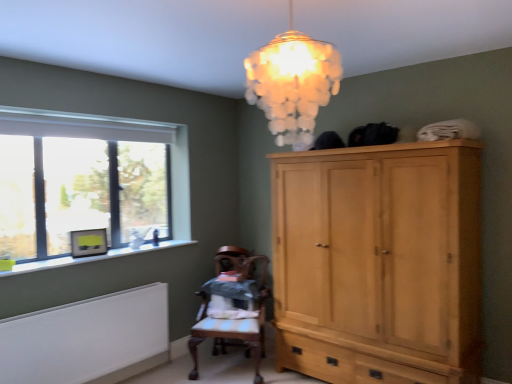
Question: Is translucent glass chandelier at upper center taller than wooden chair at center?

Choices:
 (A) no
 (B) yes

Answer: (A)

Question: Is translucent glass chandelier at upper center looking in the opposite direction of wooden chair at center?

Choices:
 (A) no
 (B) yes

Answer: (A)

Question: Can wooden chair at center be found inside translucent glass chandelier at upper center?

Choices:
 (A) yes
 (B) no

Answer: (B)

Question: Does translucent glass chandelier at upper center appear on the left side of wooden chair at center?

Choices:
 (A) no
 (B) yes

Answer: (A)

Question: Can you see translucent glass chandelier at upper center touching wooden chair at center?

Choices:
 (A) no
 (B) yes

Answer: (A)

Question: Considering the relative sizes of translucent glass chandelier at upper center and wooden chair at center in the image provided, is translucent glass chandelier at upper center thinner than wooden chair at center?

Choices:
 (A) yes
 (B) no

Answer: (A)

Question: Does wooden chair at center turn towards clear glass window at left?

Choices:
 (A) no
 (B) yes

Answer: (A)

Question: Is wooden chair at center taller than clear glass window at left?

Choices:
 (A) no
 (B) yes

Answer: (A)

Question: From the image's perspective, is wooden chair at center above clear glass window at left?

Choices:
 (A) no
 (B) yes

Answer: (A)

Question: Is wooden chair at center beside clear glass window at left?

Choices:
 (A) yes
 (B) no

Answer: (B)

Question: From a real-world perspective, is wooden chair at center below clear glass window at left?

Choices:
 (A) yes
 (B) no

Answer: (A)

Question: Would you say wooden chair at center contains clear glass window at left?

Choices:
 (A) yes
 (B) no

Answer: (B)

Question: From the image's perspective, is wooden chair at center located above white painted radiator at lower left?

Choices:
 (A) no
 (B) yes

Answer: (B)